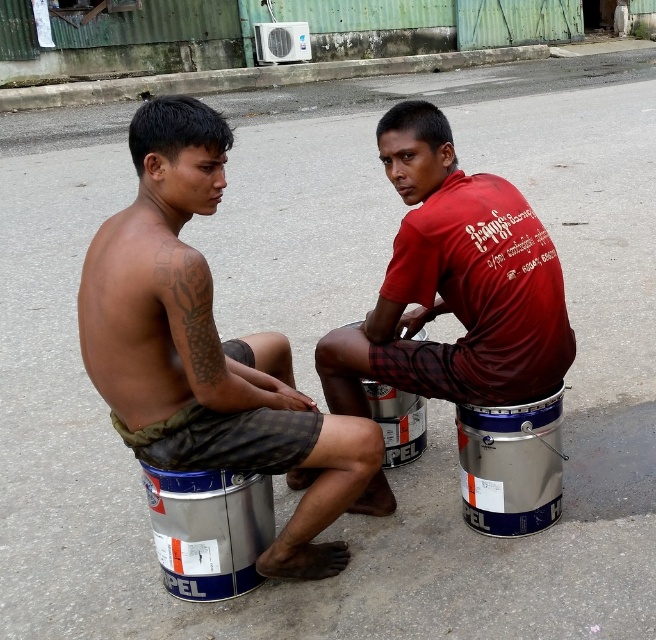
Is matte black torso at left to the left of matte red shirt at center from the viewer's perspective?

Yes, matte black torso at left is to the left of matte red shirt at center.

Who is shorter, matte black torso at left or matte red shirt at center?

With less height is matte red shirt at center.

Where is `matte black torso at left`? Image resolution: width=656 pixels, height=640 pixels. matte black torso at left is located at coordinates (x=207, y=348).